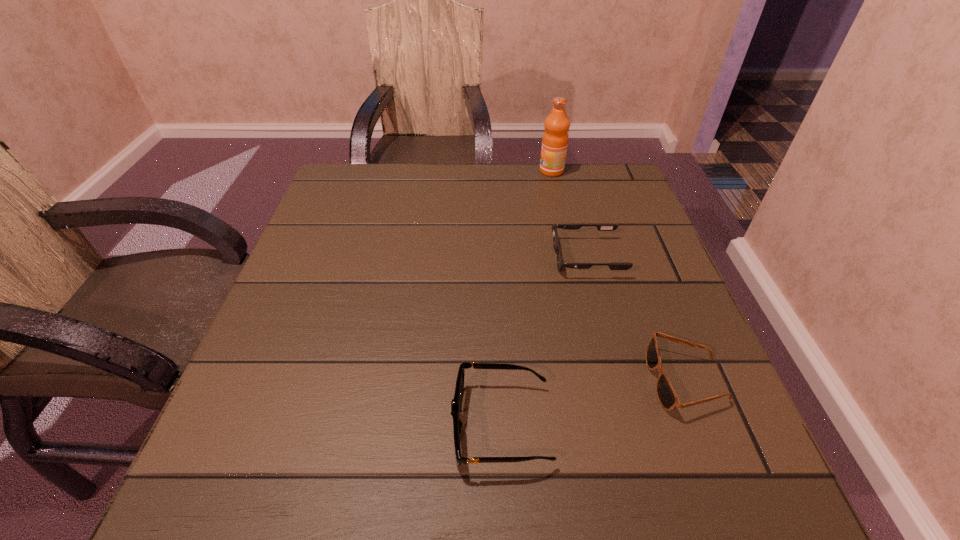
You are a GUI agent. You are given a task and a screenshot of the screen. Output one action in this format:
    pyautogui.click(x=<x>, y=<y>)
    Task: Click on the free space at the far right corner
    
    Given the screenshot: What is the action you would take?
    pyautogui.click(x=629, y=195)

Image resolution: width=960 pixels, height=540 pixels. Identify the location of free region at the near right corner of the desktop. (650, 457).

In order to click on vacant area that lies between the third nearest object and the fruit juice in this screenshot , I will do click(569, 214).

What are the coordinates of `free space between the tallest sunglasses and the farthest sunglasses` in the screenshot? It's located at (544, 341).

The height and width of the screenshot is (540, 960). What are the coordinates of `vacant region between the tallest object and the second farthest object` in the screenshot? It's located at (569, 214).

This screenshot has width=960, height=540. I want to click on vacant area between the farthest sunglasses and the second tallest object, so click(544, 341).

You are a GUI agent. You are given a task and a screenshot of the screen. Output one action in this format:
    pyautogui.click(x=<x>, y=<y>)
    Task: Click on the second closest object to the farthest object
    This screenshot has width=960, height=540.
    Given the screenshot: What is the action you would take?
    pyautogui.click(x=666, y=395)

Identify the location of object that is the second closest to the fruit juice. (666, 395).

Find the location of `sunglasses object that ranks as the closest to the third nearest object`. sunglasses object that ranks as the closest to the third nearest object is located at coordinates (666, 395).

Locate which sunglasses ranks second in proximity to the farthest object. Please provide its 2D coordinates. Your answer should be formatted as a tuple, i.e. [(x, y)], where the tuple contains the x and y coordinates of a point satisfying the conditions above.

[(666, 395)]